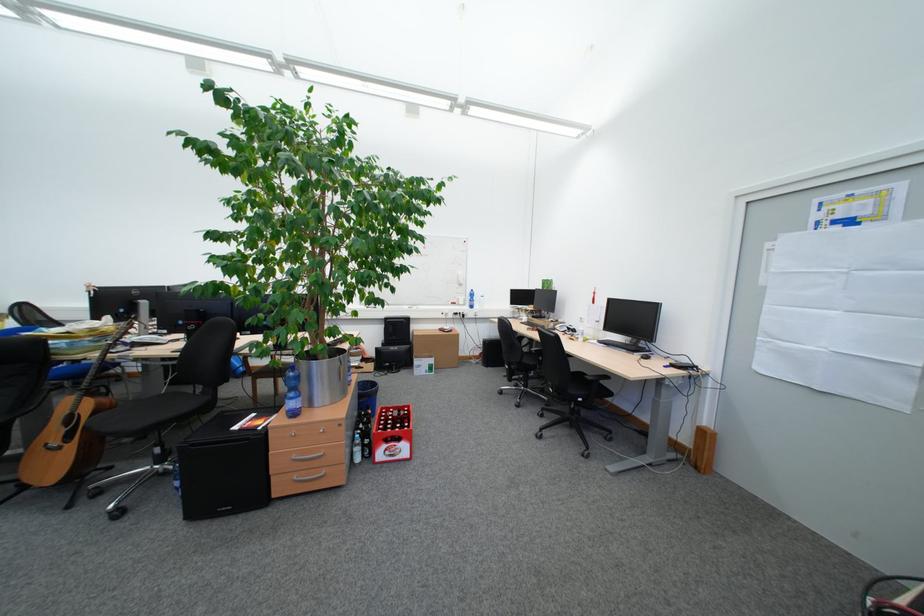
Where would you resting arm the chair armrest? Please return your answer as a coordinate pair (x, y).

(144, 373)